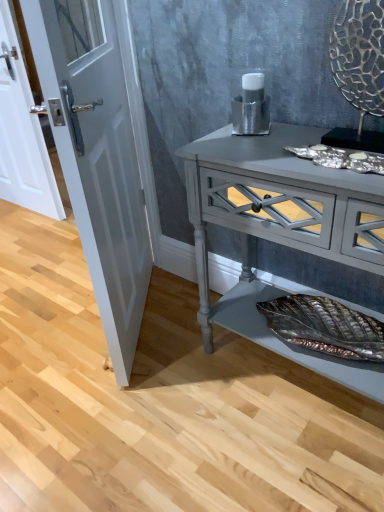
Where is `free spot in front of matte gray console table at center`? The height and width of the screenshot is (512, 384). free spot in front of matte gray console table at center is located at coordinates (287, 457).